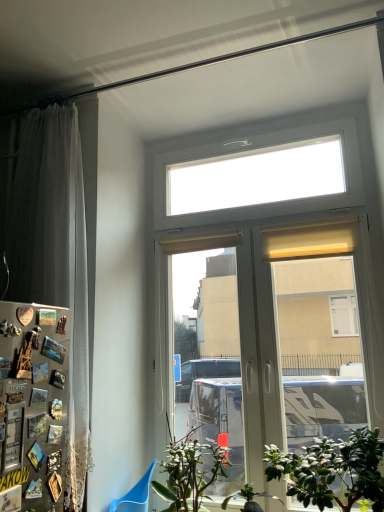
This screenshot has height=512, width=384. I want to click on free location above white plastic window at center (from a real-world perspective), so click(248, 119).